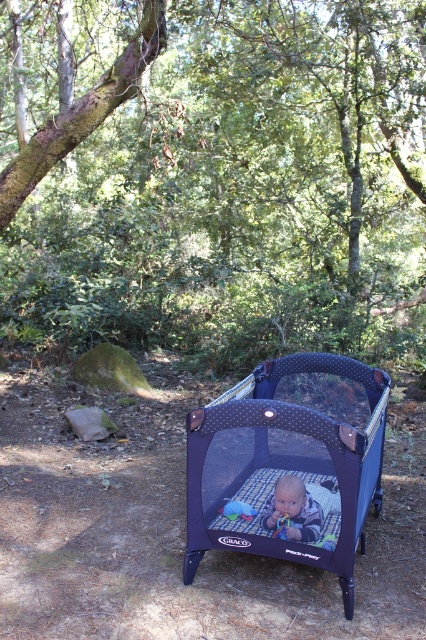
You are a parent holding a 1.2 meter long umbrella. You want to shield the dark blue fabric playpen at center from the rain. Can you position the umbrella so that it covers the playpen completely without moving the playpen?

The distance between the dark blue fabric playpen at center and the camera is 2.53 meters. Since the umbrella is 1.2 meters long, it would not be long enough to reach from your position at the camera to cover the playpen. Therefore, you cannot fully shield the playpen with the umbrella without moving closer or moving the playpen.

You are standing 20 feet away from the playpen in the forest. There is a point at coordinates point (423, 198). Is this point closer to you than the playpen?

The distance of point (423, 198) from viewer is 32.09 feet, which is farther than the 20 feet distance to the playpen. Therefore, the point is not closer to you than the playpen.

You are a parent trying to ensure the safety of your baby in the forest. You have the dark blue fabric playpen at center and the blue fabric baby at center. Which object is larger and could potentially provide more space for the baby to move around?

The dark blue fabric playpen at center is bigger than the blue fabric baby at center, so it provides more space for the baby to move around.